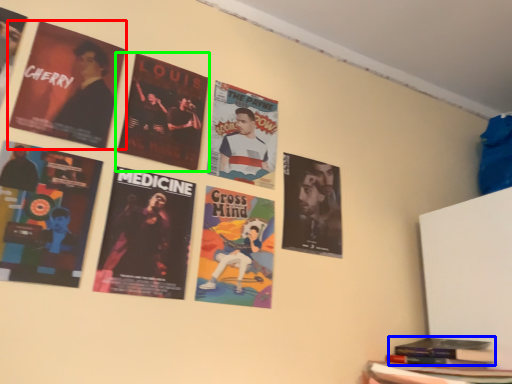
Question: Considering the real-world distances, which object is farthest from poster (highlighted by a red box)? book (highlighted by a blue box) or poster (highlighted by a green box)?

Choices:
 (A) book
 (B) poster

Answer: (A)